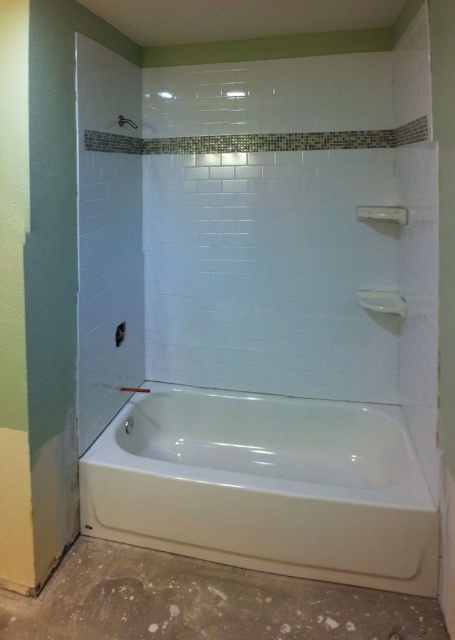
Question: In this image, where is white glossy bathtub at center located relative to white glossy shower at upper center?

Choices:
 (A) above
 (B) below

Answer: (B)

Question: Can you confirm if white glossy bathtub at center is positioned to the right of white glossy shower at upper center?

Choices:
 (A) no
 (B) yes

Answer: (B)

Question: Is white glossy bathtub at center positioned before white glossy shower at upper center?

Choices:
 (A) yes
 (B) no

Answer: (A)

Question: Which object appears closest to the camera in this image?

Choices:
 (A) white glossy bathtub at center
 (B) white glossy shower at upper center

Answer: (A)